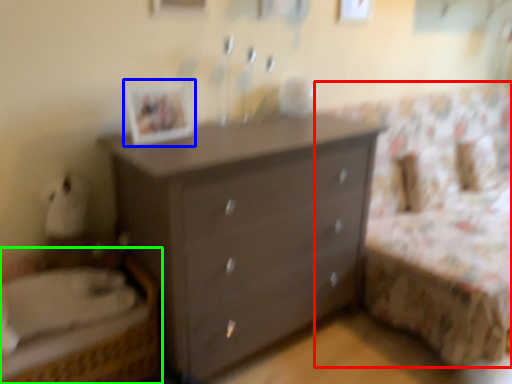
Question: Which object is the farthest from bed frame (highlighted by a red box)? Choose among these: picture frame (highlighted by a blue box) or bed (highlighted by a green box).

Choices:
 (A) picture frame
 (B) bed

Answer: (B)